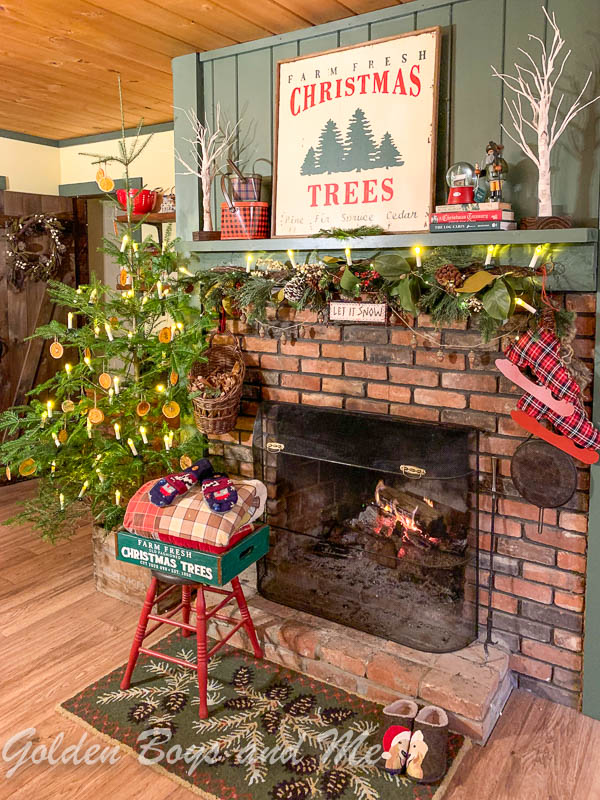
Where is `wood ceiling`? This screenshot has height=800, width=600. wood ceiling is located at coordinates (147, 21), (147, 602).